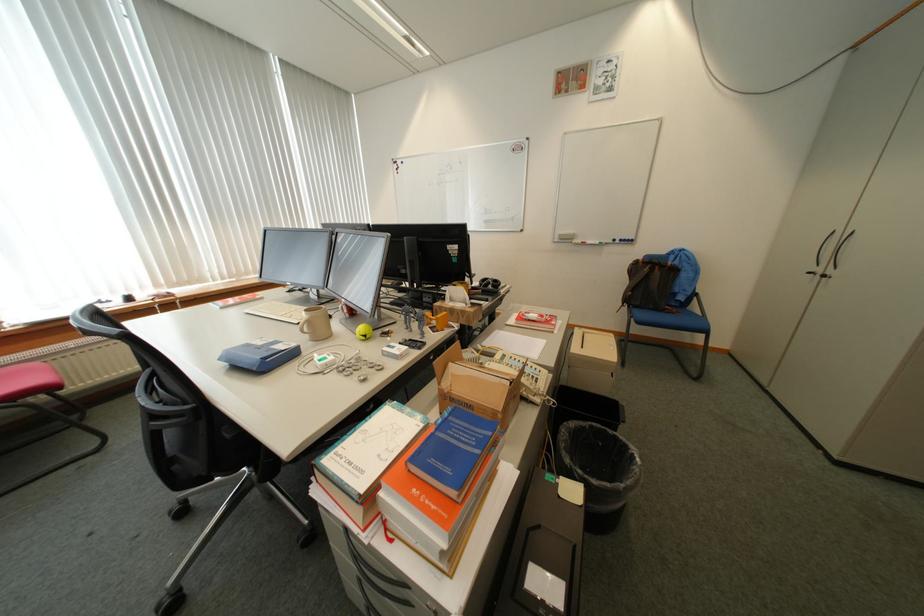
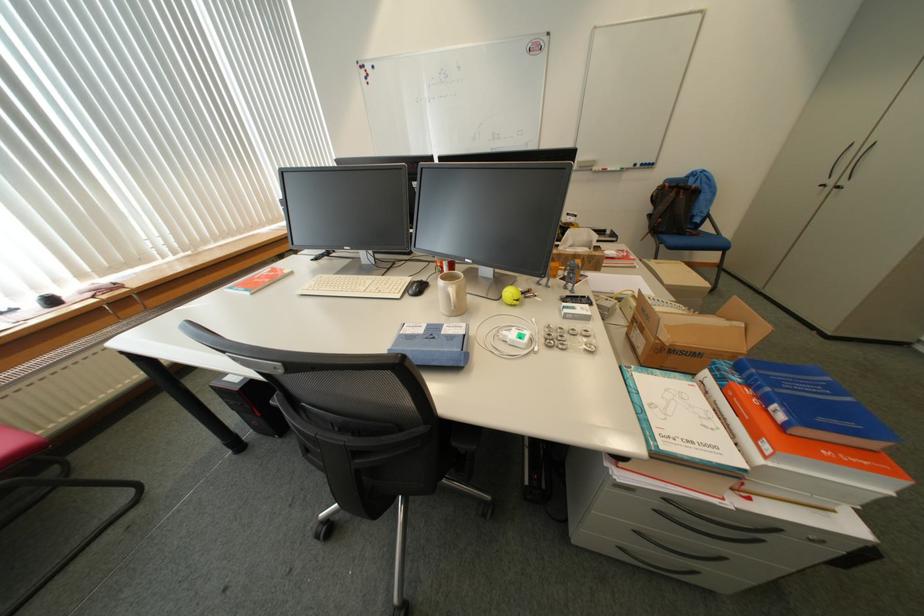
The point at (662, 270) is marked in the first image. Where is the corresponding point in the second image?

(687, 195)